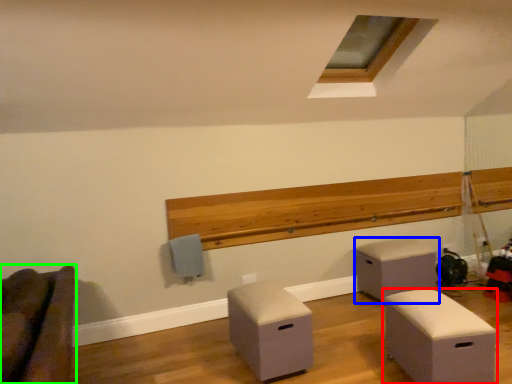
Question: Estimate the real-world distances between objects in this image. Which object is farther from furniture (highlighted by a red box), furniture (highlighted by a blue box) or furniture (highlighted by a green box)?

Choices:
 (A) furniture
 (B) furniture

Answer: (B)